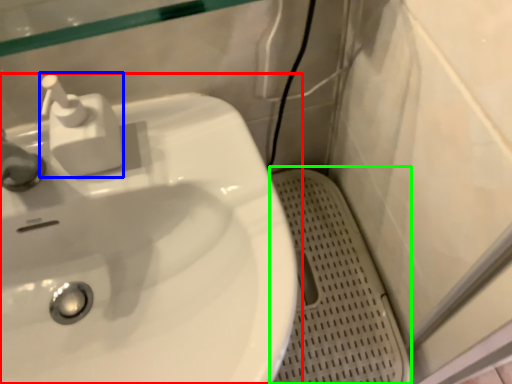
Question: Which object is the closest to the sink (highlighted by a red box)? Choose among these: soap dispenser (highlighted by a blue box) or porcelain (highlighted by a green box).

Choices:
 (A) soap dispenser
 (B) porcelain

Answer: (A)